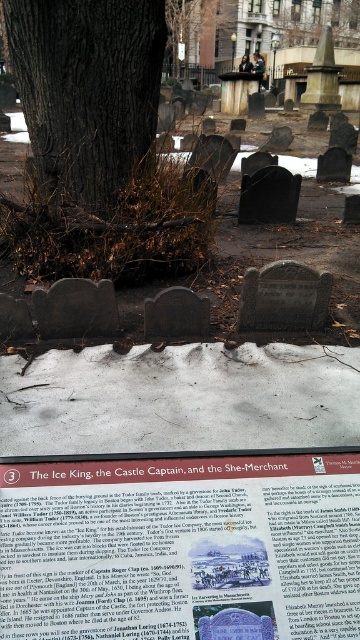
You are a visitor at the cemetery and want to read the matte brown sign at center. However, you notice the brown rough bark tree at center might be blocking your view. Can you see the sign clearly from where you stand?

The matte brown sign at center has a smaller size compared to brown rough bark tree at center, so it might be partially hidden behind the tree. You may need to move to a different angle to see the sign clearly.

You are a visitor at the cemetery and want to read the information on the matte brown sign at center. However, you notice the brown rough bark tree at center might be blocking your view. Based on the scene description, can you determine if the tree is in front of or behind the sign?

The matte brown sign at center is to the right of brown rough bark tree at center, so the tree is to the left of the sign. Since the tree is at the foreground and the sign is part of the museum exhibit at the bottom, the tree is likely behind the sign, allowing you to read it without obstruction.